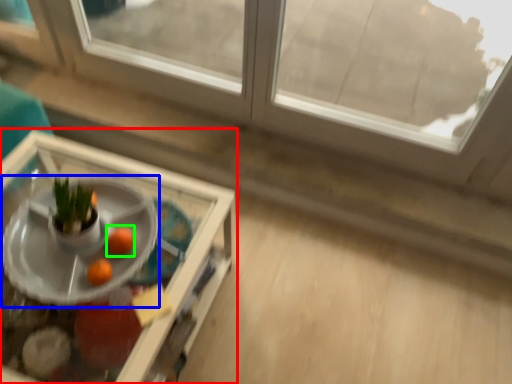
Question: Which object is positioned closest to table (highlighted by a red box)? Select from table (highlighted by a blue box) and orange (highlighted by a green box).

Choices:
 (A) table
 (B) orange

Answer: (A)